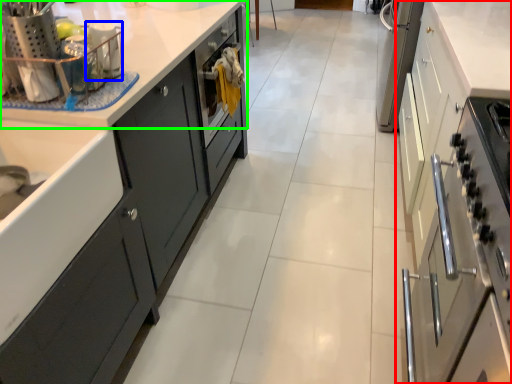
Question: Considering the real-world distances, which object is closest to cabinetry (highlighted by a red box)? appliance (highlighted by a blue box) or countertop (highlighted by a green box).

Choices:
 (A) appliance
 (B) countertop

Answer: (B)